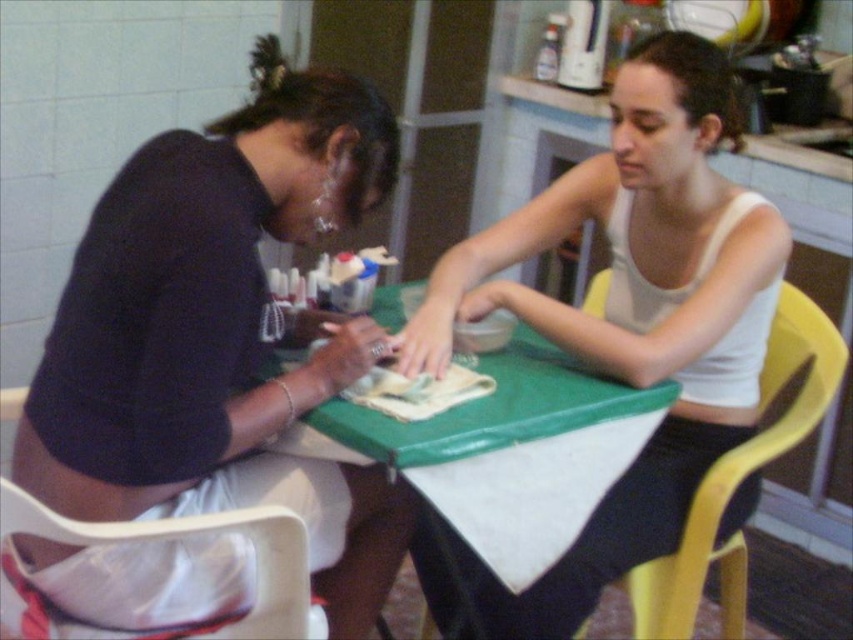
You are a person who just entered the room and need to sit down. There is a yellow plastic chair at right and a plastic bag at lower left. Which one is more suitable for sitting?

The yellow plastic chair at right is more suitable for sitting because it is much taller than the plastic bag at lower left, indicating it is a proper seating option.

What are the coordinates of the white matte tank top at center?

The white matte tank top at center is located at point [622,326].

You are organizing a small event and need to decide which item can hold more items between the white matte tank top at center and the plastic bag at lower left. Which one should you choose?

The white matte tank top at center is bigger than the plastic bag at lower left, so you should choose the white matte tank top at center to hold more items.